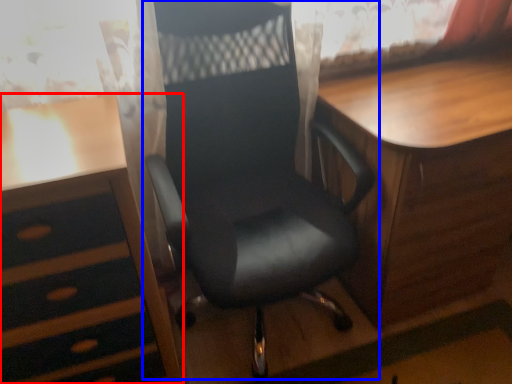
Question: Which object is closer to the camera taking this photo, desk (highlighted by a red box) or chair (highlighted by a blue box)?

Choices:
 (A) desk
 (B) chair

Answer: (B)